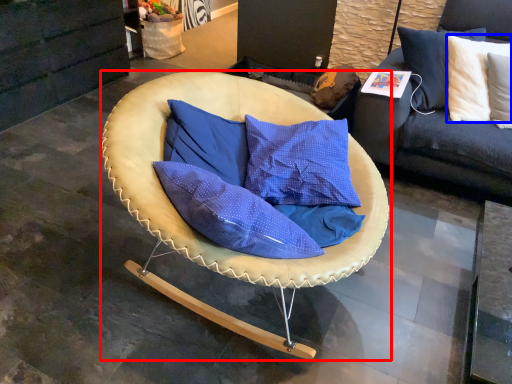
Question: Which object appears closest to the camera in this image, chair (highlighted by a red box) or pillow (highlighted by a blue box)?

Choices:
 (A) chair
 (B) pillow

Answer: (A)